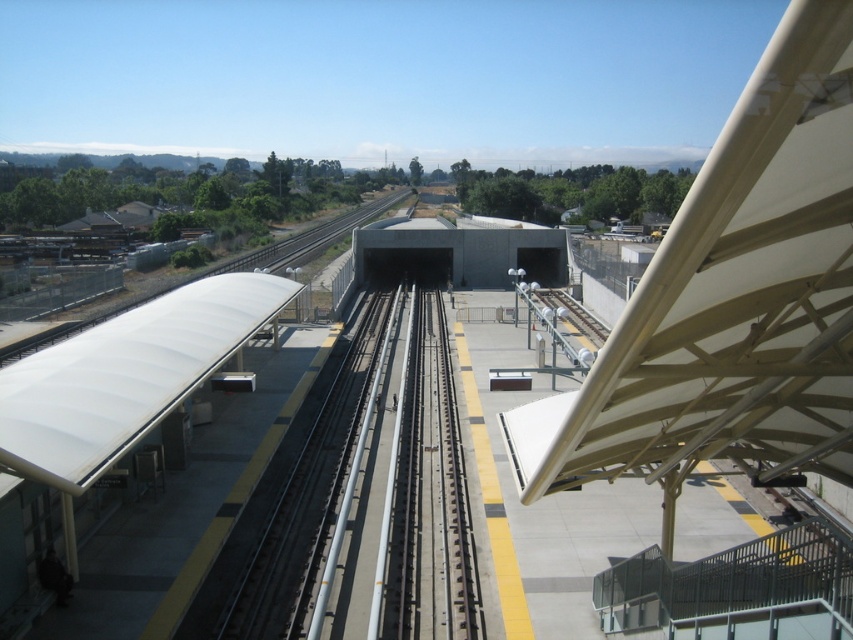
Between point (386, 536) and point (804, 534), which one is positioned in front?

Point (804, 534) is more forward.

Can you confirm if metal/smooth train track at center is bigger than white matte platform at center?

Incorrect, metal/smooth train track at center is not larger than white matte platform at center.

Where is `metal/smooth train track at center`? Image resolution: width=853 pixels, height=640 pixels. metal/smooth train track at center is located at coordinates (368, 497).

Locate an element on the screen. The image size is (853, 640). metal/smooth train track at center is located at coordinates (368, 497).